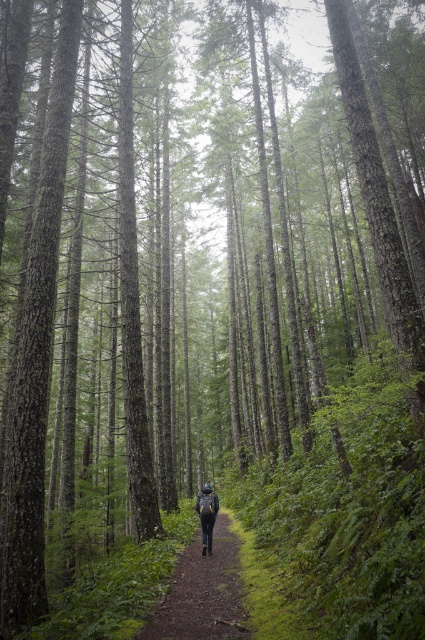
Question: Which point is closer to the camera?

Choices:
 (A) (212, 502)
 (B) (169, 634)

Answer: (B)

Question: Is brown dirt path at center smaller than matte black backpack at center?

Choices:
 (A) yes
 (B) no

Answer: (B)

Question: Does brown dirt path at center appear on the right side of matte black backpack at center?

Choices:
 (A) no
 (B) yes

Answer: (B)

Question: From the image, what is the correct spatial relationship of brown dirt path at center in relation to matte black backpack at center?

Choices:
 (A) above
 (B) below

Answer: (A)

Question: Which object appears farthest from the camera in this image?

Choices:
 (A) matte black backpack at center
 (B) brown dirt path at center

Answer: (A)

Question: Which point is farther to the camera?

Choices:
 (A) (209, 547)
 (B) (175, 577)

Answer: (A)